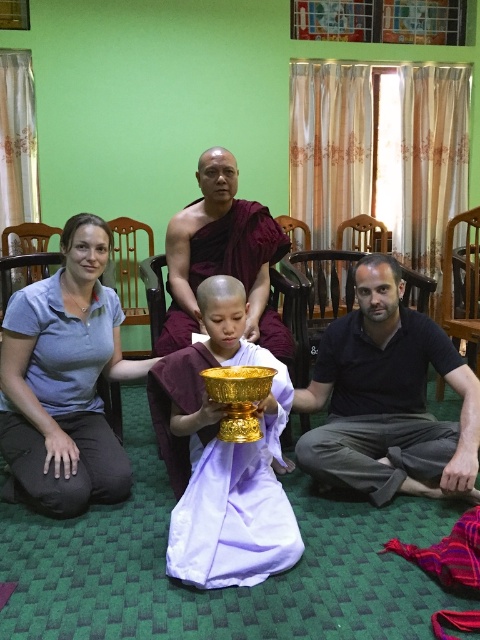
Does point (181, 515) come farther from viewer compared to point (179, 252)?

No, (181, 515) is in front of (179, 252).

Is point (276, 428) less distant than point (192, 268)?

Yes, it is in front of point (192, 268).

Find the location of a particular element. gold shiny bowl at center is located at coordinates (222, 456).

Does blue cotton shirt at lower left appear on the right side of gold shiny bowl at center?

Incorrect, blue cotton shirt at lower left is not on the right side of gold shiny bowl at center.

Can you confirm if blue cotton shirt at lower left is smaller than gold shiny bowl at center?

No, blue cotton shirt at lower left is not smaller than gold shiny bowl at center.

Which is behind, point (60, 476) or point (249, 556)?

Positioned behind is point (60, 476).

You are a GUI agent. You are given a task and a screenshot of the screen. Output one action in this format:
    pyautogui.click(x=<x>, y=<y>)
    Task: Click on the blue cotton shirt at lower left
    This screenshot has width=480, height=640.
    Given the screenshot: What is the action you would take?
    pyautogui.click(x=64, y=381)

Is gold shiny bowl at center further to the viewer compared to matte gold bowl at center?

No, it is not.

Between gold shiny bowl at center and matte gold bowl at center, which one is positioned lower?

Positioned lower is gold shiny bowl at center.

Is point (182, 512) farther from camera compared to point (75, 305)?

That is False.

At what (x,y) coordinates should I click in order to perform the action: click on gold shiny bowl at center. Please return your answer as a coordinate pair (x, y). Looking at the image, I should click on (222, 456).